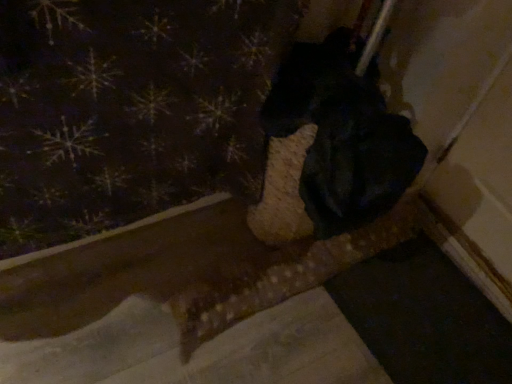
Question: Does black matte dog at center have a larger size compared to dark fabric with snowflake pattern at upper left?

Choices:
 (A) no
 (B) yes

Answer: (A)

Question: Does black matte dog at center have a greater height compared to dark fabric with snowflake pattern at upper left?

Choices:
 (A) no
 (B) yes

Answer: (A)

Question: Is black matte dog at center located outside dark fabric with snowflake pattern at upper left?

Choices:
 (A) no
 (B) yes

Answer: (B)

Question: Can dark fabric with snowflake pattern at upper left be found inside black matte dog at center?

Choices:
 (A) no
 (B) yes

Answer: (A)

Question: Can you confirm if black matte dog at center is wider than dark fabric with snowflake pattern at upper left?

Choices:
 (A) yes
 (B) no

Answer: (A)

Question: Is black matte dog at center at the right side of dark fabric with snowflake pattern at upper left?

Choices:
 (A) no
 (B) yes

Answer: (B)

Question: Does dark fabric with snowflake pattern at upper left lie behind black matte dog at center?

Choices:
 (A) no
 (B) yes

Answer: (A)

Question: Is black matte dog at center located within dark fabric with snowflake pattern at upper left?

Choices:
 (A) no
 (B) yes

Answer: (A)

Question: Can we say dark fabric with snowflake pattern at upper left lies outside black matte dog at center?

Choices:
 (A) no
 (B) yes

Answer: (B)

Question: Is dark fabric with snowflake pattern at upper left in front of black matte dog at center?

Choices:
 (A) no
 (B) yes

Answer: (B)

Question: Is dark fabric with snowflake pattern at upper left not near black matte dog at center?

Choices:
 (A) no
 (B) yes

Answer: (A)

Question: Does dark fabric with snowflake pattern at upper left turn towards black matte dog at center?

Choices:
 (A) no
 (B) yes

Answer: (A)

Question: Looking at the image, does dark fabric with snowflake pattern at upper left seem bigger or smaller compared to black matte dog at center?

Choices:
 (A) small
 (B) big

Answer: (B)